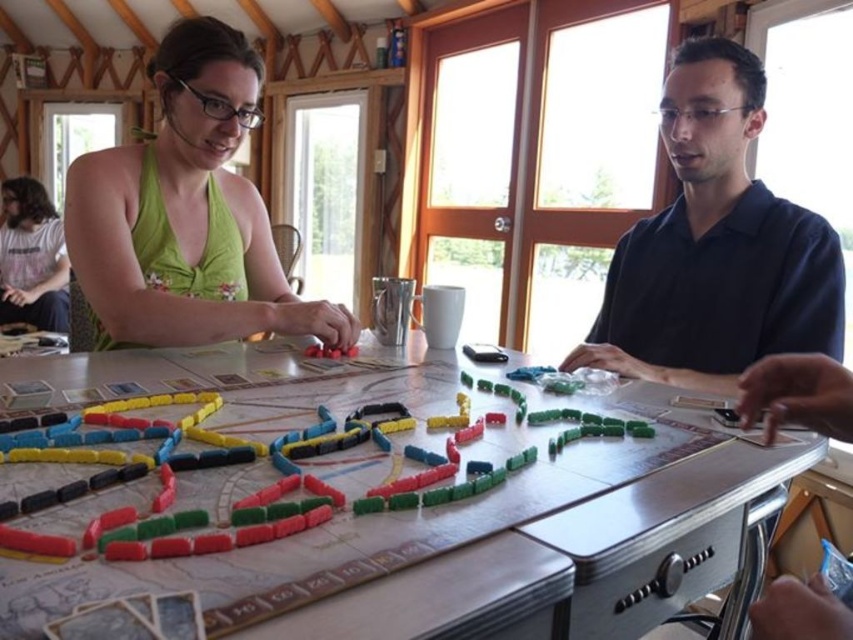
Can you confirm if green fabric dress at left is smaller than matte gray t-shirt at lower left?

Yes, green fabric dress at left is smaller than matte gray t-shirt at lower left.

Between green fabric dress at left and matte gray t-shirt at lower left, which one appears on the left side from the viewer's perspective?

From the viewer's perspective, matte gray t-shirt at lower left appears more on the left side.

Consider the image. Who is more forward, (149, 340) or (3, 305)?

Point (149, 340) is in front.

At what (x,y) coordinates should I click in order to perform the action: click on green fabric dress at left. Please return your answer as a coordinate pair (x, y). Looking at the image, I should click on (187, 212).

Can you confirm if dark blue shirt at right is shorter than green fabric dress at left?

In fact, dark blue shirt at right may be taller than green fabric dress at left.

Who is positioned more to the left, dark blue shirt at right or green fabric dress at left?

green fabric dress at left is more to the left.

Locate an element on the screen. dark blue shirt at right is located at coordinates (715, 246).

At what (x,y) coordinates should I click in order to perform the action: click on dark blue shirt at right. Please return your answer as a coordinate pair (x, y). This screenshot has height=640, width=853. Looking at the image, I should click on (715, 246).

Can you confirm if wooden table at center is smaller than green fabric dress at left?

No, wooden table at center is not smaller than green fabric dress at left.

Is wooden table at center thinner than green fabric dress at left?

No, wooden table at center is not thinner than green fabric dress at left.

Does point (26, 611) come closer to viewer compared to point (97, 248)?

Yes.

At what (x,y) coordinates should I click in order to perform the action: click on wooden table at center. Please return your answer as a coordinate pair (x, y). This screenshot has width=853, height=640. Looking at the image, I should click on (473, 538).